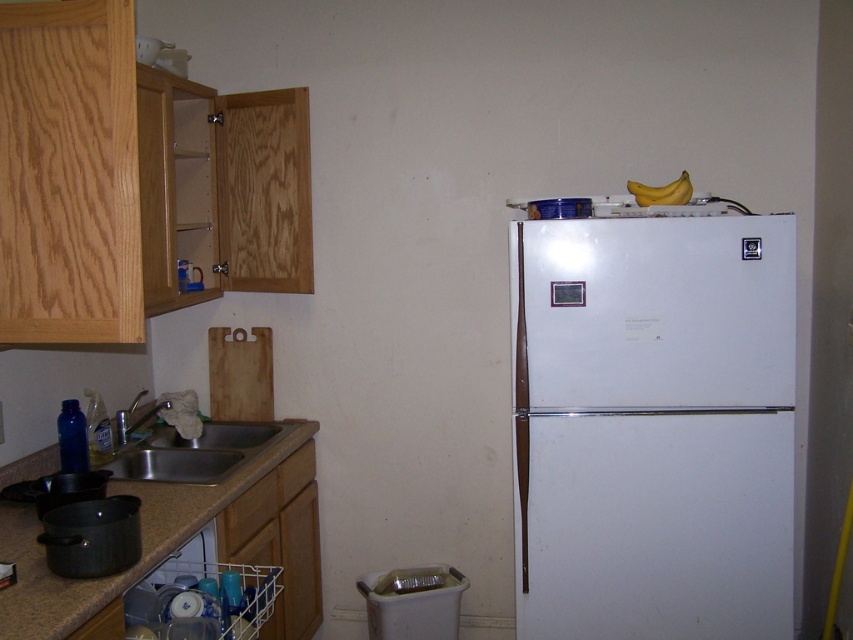
In the scene shown: You have a 8 inch long spatula that you need to place between the brown granite countertop at lower left and the white plastic dish washer at lower left. Will it fit without overlapping either?

The brown granite countertop at lower left and white plastic dish washer at lower left are 9.09 inches apart, so an 8 inch long spatula can fit between them without overlapping either.

You are standing in the kitchen and need to place a heavy pot on the brown granite countertop at lower left. Where exactly should you place it?

The brown granite countertop at lower left is located at point (143,545), so you should place the pot there.